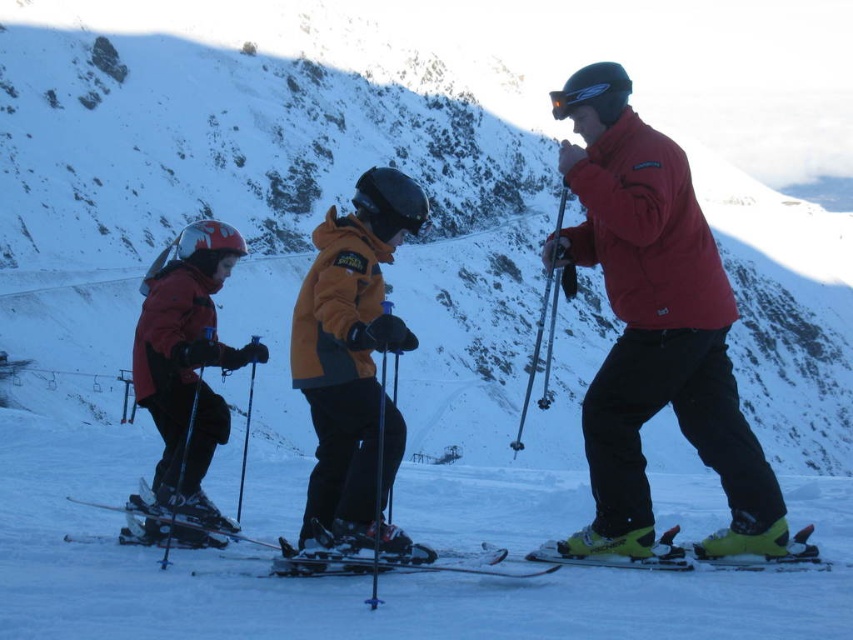
You are a photographer standing at the base of the mountain. You want to take a photo of the matte black ski suit at left and the shiny black ski at center. Based on their heights, which object will appear larger in the photo?

The matte black ski suit at left is much taller than the shiny black ski at center, so it will appear larger in the photo.

You are standing at the camera position and want to reach the point marked at coordinates point (744, 524). If you walk straight ahead, how far will you have to walk to reach that point?

The point marked at coordinates point (744, 524) is 34.54 meters away from the camera, so you will have to walk 34.54 meters straight ahead to reach it.

You are a ski instructor observing the skiers at the ski resort. You notice two points marked on the slope. The first point is at coordinates point (x=170, y=461) and the second is at point (x=427, y=554). Which point is closer to the base of the mountain?

Point (x=170, y=461) is behind point (x=427, y=554), so the point closer to the base of the mountain would be point (x=427, y=554) since it is in front.